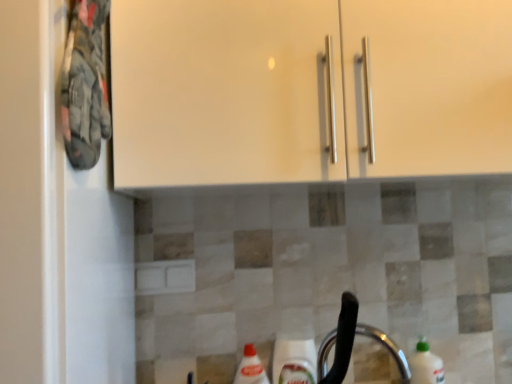
What do you see at coordinates (425, 365) in the screenshot? I see `green plastic bottle at lower right` at bounding box center [425, 365].

You are a GUI agent. You are given a task and a screenshot of the screen. Output one action in this format:
    pyautogui.click(x=<x>, y=<y>)
    Task: Click on the green plastic bottle at lower right
    Image resolution: width=512 pixels, height=384 pixels.
    Given the screenshot: What is the action you would take?
    pyautogui.click(x=425, y=365)

What do you see at coordinates (387, 348) in the screenshot? Image resolution: width=512 pixels, height=384 pixels. I see `silver metallic faucet at lower center` at bounding box center [387, 348].

At what (x,y) coordinates should I click in order to perform the action: click on silver metallic faucet at lower center. Please return your answer as a coordinate pair (x, y). The image size is (512, 384). Looking at the image, I should click on (387, 348).

You are a GUI agent. You are given a task and a screenshot of the screen. Output one action in this format:
    pyautogui.click(x=<x>, y=<y>)
    Task: Click on the green plastic bottle at lower right
    Image resolution: width=512 pixels, height=384 pixels.
    Given the screenshot: What is the action you would take?
    pyautogui.click(x=425, y=365)

Which object is positioned more to the left, green plastic bottle at lower right or silver metallic faucet at lower center?

Positioned to the left is silver metallic faucet at lower center.

Which object is closer to the camera taking this photo, green plastic bottle at lower right or silver metallic faucet at lower center?

silver metallic faucet at lower center is in front.

Does point (435, 363) lie behind point (404, 378)?

No, it is not.

From the image's perspective, which one is positioned lower, green plastic bottle at lower right or silver metallic faucet at lower center?

From the image's view, green plastic bottle at lower right is below.

From a real-world perspective, between green plastic bottle at lower right and silver metallic faucet at lower center, who is vertically lower?

From a 3D spatial view, green plastic bottle at lower right is below.

Considering the sizes of green plastic bottle at lower right and silver metallic faucet at lower center in the image, is green plastic bottle at lower right wider or thinner than silver metallic faucet at lower center?

green plastic bottle at lower right is thinner than silver metallic faucet at lower center.

Is green plastic bottle at lower right taller than silver metallic faucet at lower center?

Correct, green plastic bottle at lower right is much taller as silver metallic faucet at lower center.

Considering the sizes of objects green plastic bottle at lower right and silver metallic faucet at lower center in the image provided, who is smaller, green plastic bottle at lower right or silver metallic faucet at lower center?

With smaller size is green plastic bottle at lower right.

Is green plastic bottle at lower right outside of silver metallic faucet at lower center?

green plastic bottle at lower right lies outside silver metallic faucet at lower center's area.

Is green plastic bottle at lower right not near silver metallic faucet at lower center?

No, green plastic bottle at lower right is in close proximity to silver metallic faucet at lower center.

Is green plastic bottle at lower right facing towards silver metallic faucet at lower center?

No, green plastic bottle at lower right is not aimed at silver metallic faucet at lower center.

Locate an element on the screen. The height and width of the screenshot is (384, 512). cleaning product that is behind the silver metallic faucet at lower center is located at coordinates (425, 365).

Which object is positioned more to the right, silver metallic faucet at lower center or green plastic bottle at lower right?

green plastic bottle at lower right.

Which object is closer to the camera taking this photo, silver metallic faucet at lower center or green plastic bottle at lower right?

Positioned in front is silver metallic faucet at lower center.

Which is closer, (405, 383) or (410, 358)?

Point (405, 383).

From the image's perspective, between silver metallic faucet at lower center and green plastic bottle at lower right, which one is located above?

silver metallic faucet at lower center.

From a real-world perspective, is silver metallic faucet at lower center positioned over green plastic bottle at lower right based on gravity?

Yes.

Looking at their sizes, would you say silver metallic faucet at lower center is wider or thinner than green plastic bottle at lower right?

silver metallic faucet at lower center is wider than green plastic bottle at lower right.

Between silver metallic faucet at lower center and green plastic bottle at lower right, which one has more height?

Standing taller between the two is green plastic bottle at lower right.

Who is smaller, silver metallic faucet at lower center or green plastic bottle at lower right?

With smaller size is green plastic bottle at lower right.

Is green plastic bottle at lower right a part of silver metallic faucet at lower center?

No, silver metallic faucet at lower center does not contain green plastic bottle at lower right.

Are silver metallic faucet at lower center and green plastic bottle at lower right far apart?

No.

Is silver metallic faucet at lower center oriented away from green plastic bottle at lower right?

No, silver metallic faucet at lower center's orientation is not away from green plastic bottle at lower right.

How many degrees apart are the facing directions of silver metallic faucet at lower center and green plastic bottle at lower right?

silver metallic faucet at lower center and green plastic bottle at lower right are facing 94.8 degrees away from each other.

Identify the location of faucet above the green plastic bottle at lower right (from the image's perspective). This screenshot has height=384, width=512. coord(387,348).

This screenshot has height=384, width=512. Identify the location of faucet that appears on the left of green plastic bottle at lower right. (387, 348).

Image resolution: width=512 pixels, height=384 pixels. I want to click on cleaning product behind the silver metallic faucet at lower center, so click(425, 365).